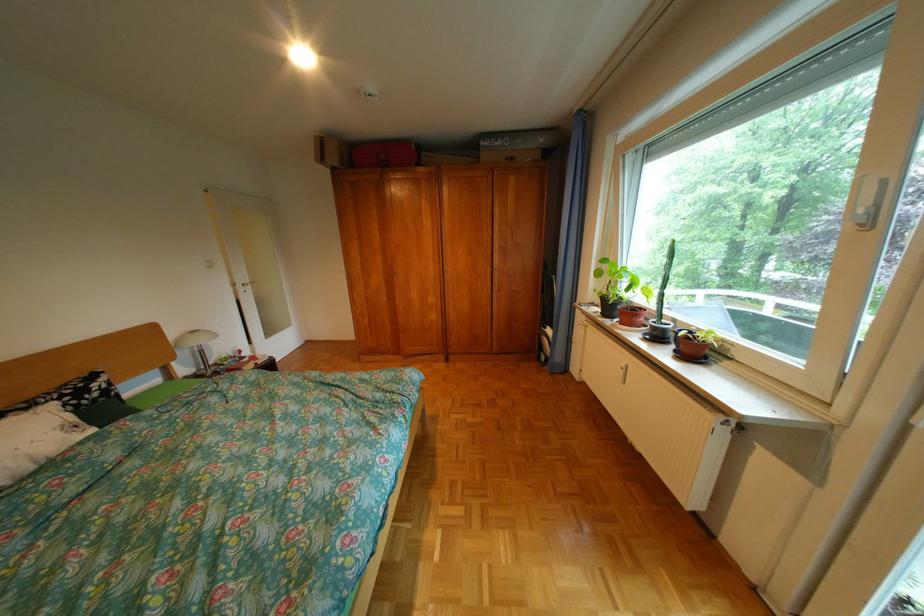
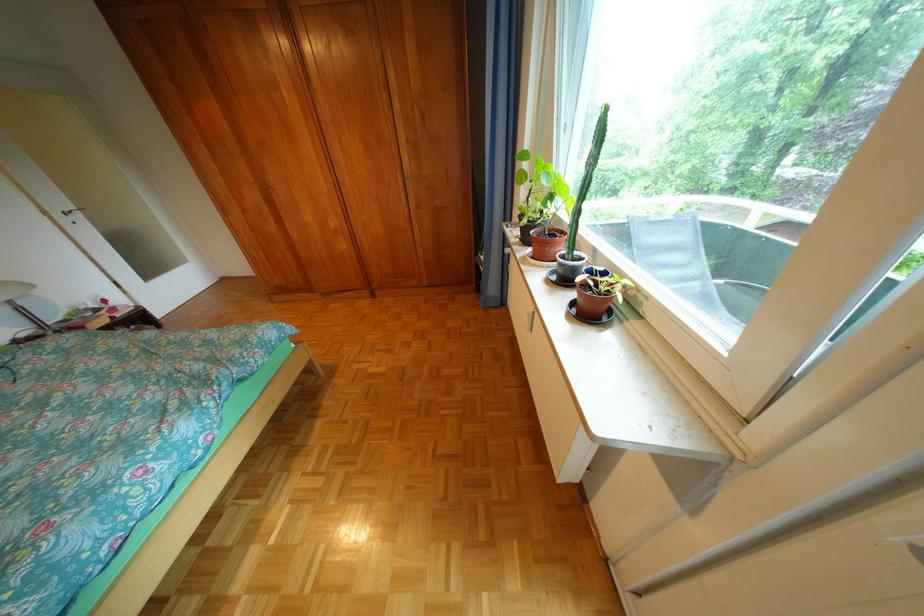
The point at [690,353] is marked in the first image. Where is the corresponding point in the second image?

(588, 304)